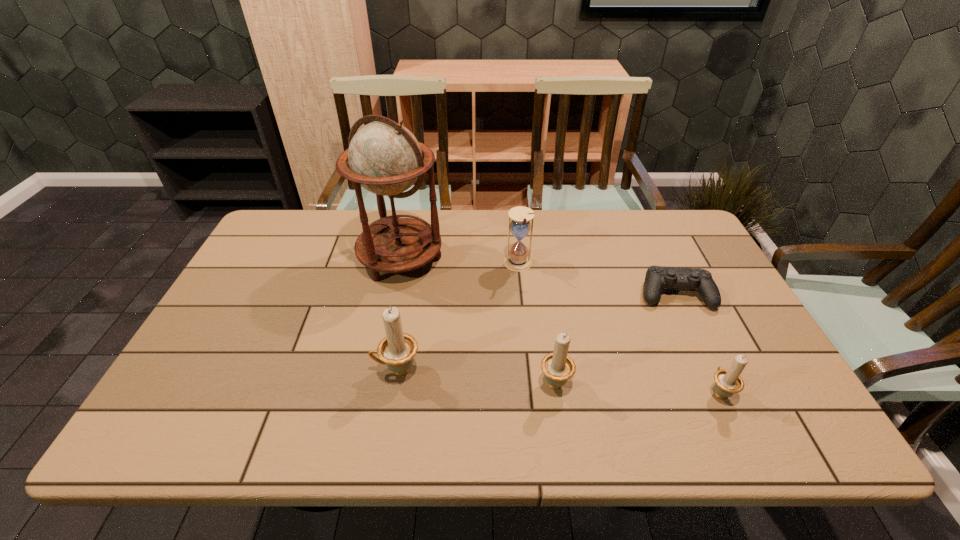
The height and width of the screenshot is (540, 960). What are the coordinates of `candle_holder that is the third closest to the tallest object` in the screenshot? It's located at (728, 382).

The image size is (960, 540). I want to click on free space that satisfies the following two spatial constraints: 1. on the handle side of the tallest candle_holder; 2. on the handle side of the third shortest object, so click(x=396, y=381).

Find the location of a particular element. free space that satisfies the following two spatial constraints: 1. on the handle side of the shortest object; 2. on the left side of the rightmost candle_holder is located at coordinates (673, 294).

You are a GUI agent. You are given a task and a screenshot of the screen. Output one action in this format:
    pyautogui.click(x=<x>, y=<y>)
    Task: Click on the vacant space that satisfies the following two spatial constraints: 1. on the handle side of the second candle_holder from left to right; 2. on the right side of the shortest object
    The width and height of the screenshot is (960, 540).
    Given the screenshot: What is the action you would take?
    pyautogui.click(x=541, y=294)

Where is `vacant position in the image that satisfies the following two spatial constraints: 1. on the handle side of the fifth tallest object; 2. on the handle side of the leftmost candle_holder`? This screenshot has width=960, height=540. vacant position in the image that satisfies the following two spatial constraints: 1. on the handle side of the fifth tallest object; 2. on the handle side of the leftmost candle_holder is located at coordinates (708, 370).

Find the location of `free space that satisfies the following two spatial constraints: 1. on the surface of the tallest object; 2. on the left side of the shortest object`. free space that satisfies the following two spatial constraints: 1. on the surface of the tallest object; 2. on the left side of the shortest object is located at coordinates (393, 294).

Find the location of a particular element. vacant space that satisfies the following two spatial constraints: 1. on the handle side of the second tallest candle_holder; 2. on the right side of the control is located at coordinates (541, 294).